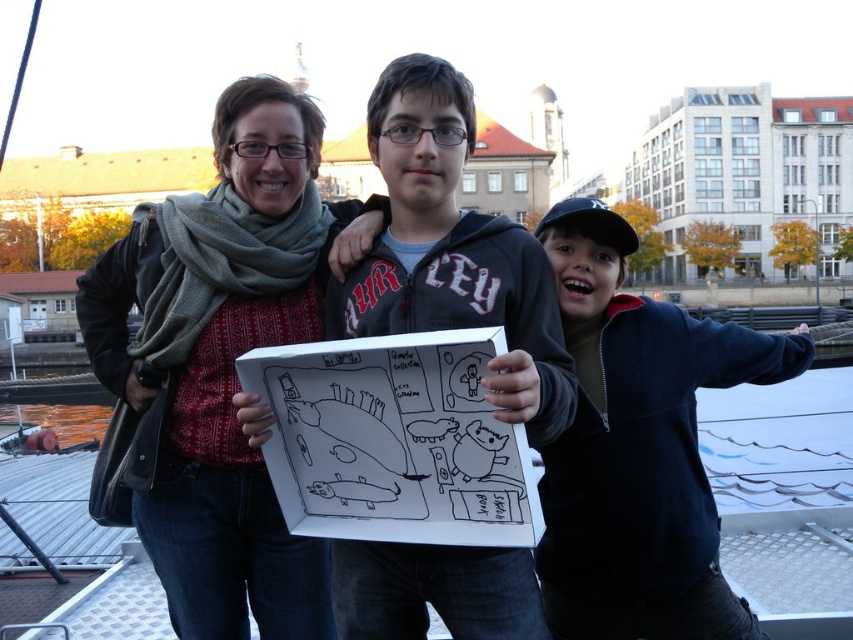
You are a photographer trying to capture the two items at the center of the scene. Which one is on the left when looking at the matte gray scarf at center and the dark blue fleece jacket at center?

The matte gray scarf at center is positioned on the left side of the dark blue fleece jacket at center.

You are a photographer trying to capture a clear shot of the matte gray scarf at center and the dark blue fleece jacket at center. Based on their heights, which object should you focus on first to ensure both are in frame?

The matte gray scarf at center is taller than the dark blue fleece jacket at center, so you should focus on the matte gray scarf at center first to ensure both are in frame.

Looking at this image, in the image, there are three people standing outdoors near a water body with buildings in the background. The central person is wearing a dark blue fleece jacket. If you were to draw a coordinate system on the image where the bottom left corner is the origin, what are the coordinates of the dark blue fleece jacket at center?

The coordinates of the dark blue fleece jacket at center are at point (637, 448).